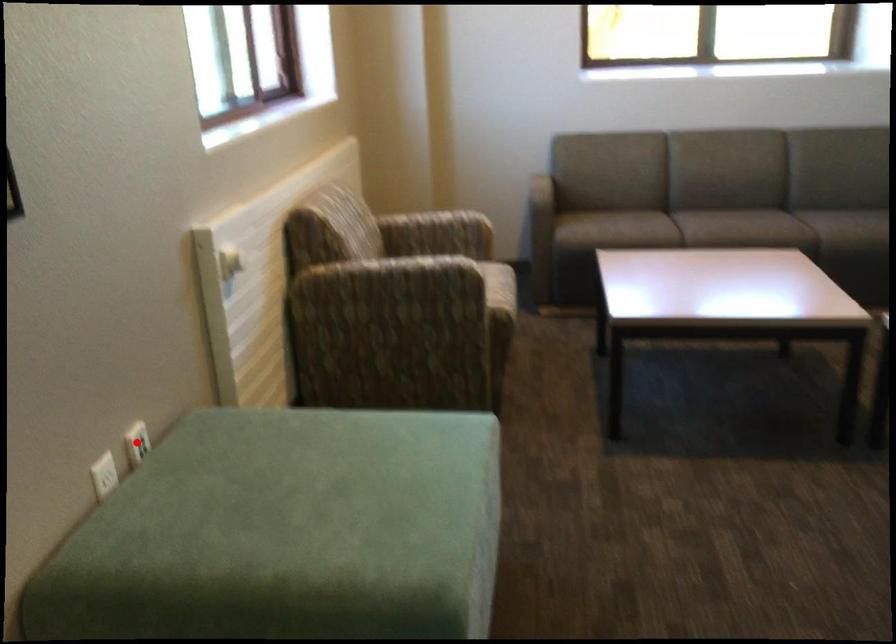
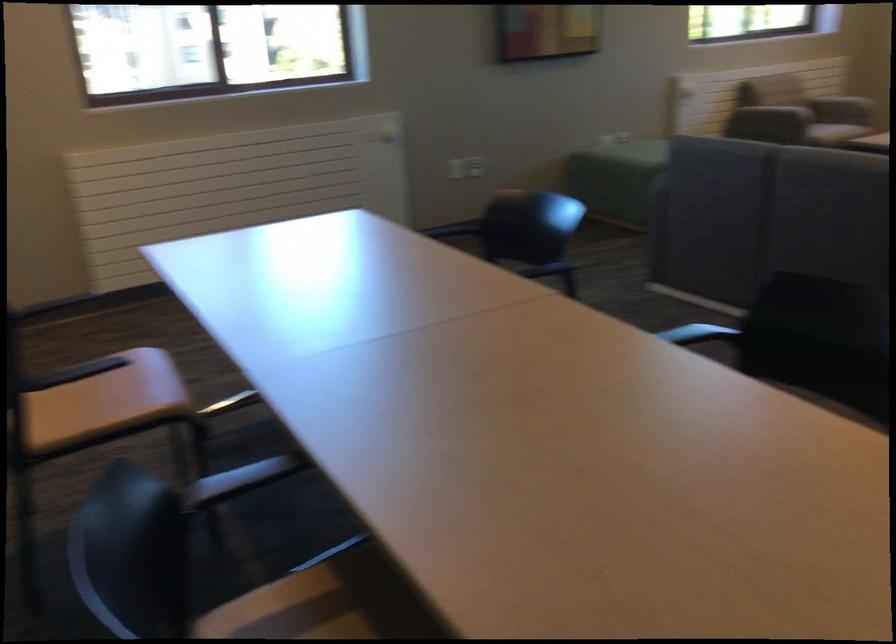
Question: I am providing you with two images of the same scene from different viewpoints. A red point is marked on the first image. At the location where the point appears in image 1, is it still visible in image 2?

Choices:
 (A) Yes
 (B) No

Answer: (B)